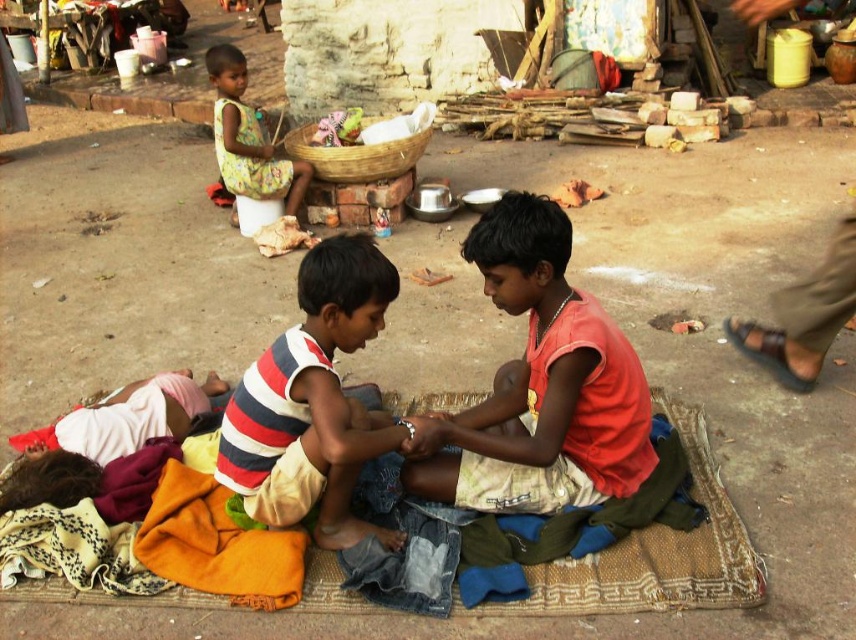
You are a photographer trying to capture both the orange cotton shirt at center and the striped fabric shirt at center in a single shot. Which shirt should you focus on first to ensure both are in the frame?

You should focus on the orange cotton shirt at center first because it is closer to the viewer than the striped fabric shirt at center, ensuring both are in the frame.

You are a photographer trying to capture both the orange cotton shirt at center and the printed fabric dress at upper left in a single shot. Which object should you focus on first to ensure both are in clear view?

You should focus on the orange cotton shirt at center first because it is closer to the viewer than the printed fabric dress at upper left, ensuring both will be in focus when using depth of field techniques.

You are a photographer trying to capture both the orange cotton shirt at center and the striped fabric shirt at center in a single frame. Since you can only focus on one shirt at a time, which shirt should you adjust your camera to focus on first if you want to ensure both are visible in the frame?

The orange cotton shirt at center is to the right of striped fabric shirt at center, so you should focus on the striped fabric shirt at center first as it is closer to the left side of the frame, allowing the orange cotton shirt at center to naturally fall into the right side of the frame when adjusting the focus.